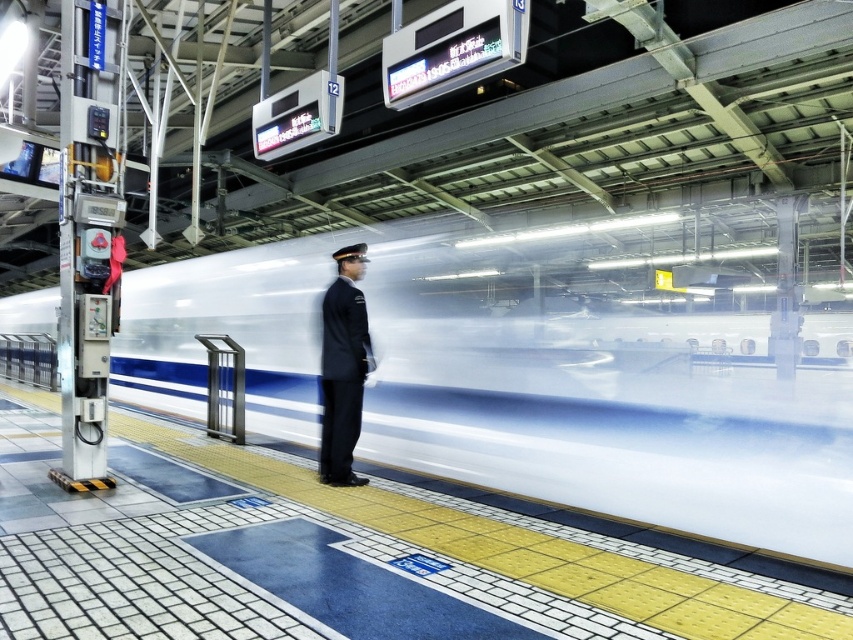
Question: Which point is closer to the camera?

Choices:
 (A) dark blue uniform at center
 (B) white glossy train at center

Answer: (B)

Question: Which object is farther from the camera taking this photo?

Choices:
 (A) white glossy train at center
 (B) yellow tactile paving at center

Answer: (A)

Question: From the image, what is the correct spatial relationship of yellow tactile paving at center in relation to dark blue uniform at center?

Choices:
 (A) above
 (B) below

Answer: (B)

Question: Is yellow tactile paving at center wider than dark blue uniform at center?

Choices:
 (A) yes
 (B) no

Answer: (A)

Question: Does white glossy train at center appear on the right side of dark blue uniform at center?

Choices:
 (A) no
 (B) yes

Answer: (A)

Question: Which of the following is the closest to the observer?

Choices:
 (A) (338, 376)
 (B) (734, 417)
 (C) (293, 476)

Answer: (A)